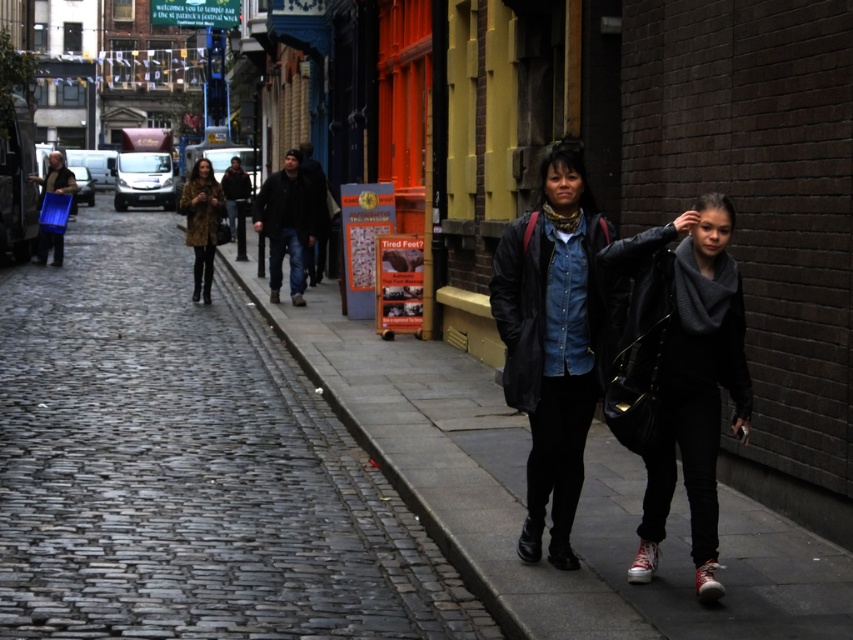
Based on the photo, between dark blue jeans at center and dark brown leather jacket at center, which one is positioned lower?

dark blue jeans at center is below.

The width and height of the screenshot is (853, 640). What do you see at coordinates (286, 224) in the screenshot?
I see `dark blue jeans at center` at bounding box center [286, 224].

Describe the element at coordinates (286, 224) in the screenshot. I see `dark blue jeans at center` at that location.

I want to click on dark blue jeans at center, so click(286, 224).

Is denim jacket at center smaller than blue plastic bag at left?

Yes, denim jacket at center is smaller than blue plastic bag at left.

Between point (602, 296) and point (61, 257), which one is positioned in front?

Positioned in front is point (602, 296).

Is point (585, 348) positioned in front of point (61, 248)?

Yes, point (585, 348) is closer to viewer.

This screenshot has width=853, height=640. Identify the location of denim jacket at center. (555, 340).

Is point (291, 273) less distant than point (51, 164)?

Yes, point (291, 273) is in front of point (51, 164).

What are the coordinates of `dark blue jeans at center` in the screenshot? It's located at (286, 224).

Which is behind, point (274, 212) or point (74, 192)?

The point (74, 192) is more distant.

What are the coordinates of `dark blue jeans at center` in the screenshot? It's located at (286, 224).